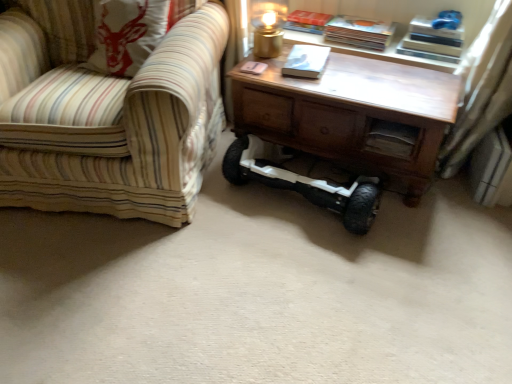
Measure the distance between hardcover book at upper right, positioned as the second book in front-to-back order, and camera.

hardcover book at upper right, positioned as the second book in front-to-back order, is 1.91 meters away from camera.

Identify the location of hardcover book at upper right, positioned as the second book in front-to-back order. (359, 32).

In order to face striped fabric chair at left, should I rotate leftwards or rightwards?

To face it directly, rotate left by 20.565 degrees.

At what (x,y) coordinates should I click in order to perform the action: click on striped fabric chair at left. Please return your answer as a coordinate pair (x, y). Looking at the image, I should click on (112, 124).

Find the location of `gold metallic table lamp at upper center`. gold metallic table lamp at upper center is located at coordinates tap(268, 26).

What do you see at coordinates (391, 139) in the screenshot? I see `wooden drawer at center` at bounding box center [391, 139].

Describe the element at coordinates (305, 180) in the screenshot. I see `white matte hoverboard at center` at that location.

What do you see at coordinates (307, 21) in the screenshot? The height and width of the screenshot is (384, 512). I see `hardcover book at upper center, the third book viewed from the front` at bounding box center [307, 21].

The height and width of the screenshot is (384, 512). I want to click on hardcover book at upper right, positioned as the second book in front-to-back order, so click(x=359, y=32).

Is white matte book at center, positioned as the 3th book in back-to-front order, facing away from striped fabric chair at left?

No.

From the image's perspective, is white matte book at center, marked as the first book in a front-to-back arrangement, over striped fabric chair at left?

Indeed, from the image's perspective, white matte book at center, marked as the first book in a front-to-back arrangement, is shown above striped fabric chair at left.

How many degrees apart are the facing directions of white matte book at center, positioned as the 3th book in back-to-front order, and striped fabric chair at left?

They differ by 8.96 degrees in their facing directions.

Which point is more forward, [311,48] or [34,101]?

The point [34,101] is closer.

How different are the orientations of wooden table at center and white matte book at center, marked as the first book in a front-to-back arrangement, in degrees?

There is a 9.18-degree angle between the facing directions of wooden table at center and white matte book at center, marked as the first book in a front-to-back arrangement.

Which object is closer to the camera taking this photo, wooden table at center or white matte book at center, marked as the first book in a front-to-back arrangement?

wooden table at center is more forward.

Which of these two, wooden table at center or white matte book at center, positioned as the 3th book in back-to-front order, stands shorter?

Standing shorter between the two is white matte book at center, positioned as the 3th book in back-to-front order.

Is wooden table at center in contact with white matte book at center, positioned as the 3th book in back-to-front order?

wooden table at center is not next to white matte book at center, positioned as the 3th book in back-to-front order, and they're not touching.

Locate an element on the screen. The width and height of the screenshot is (512, 384). chair on the left of white matte book at center, positioned as the 3th book in back-to-front order is located at coordinates (112, 124).

Consider the image. From a real-world perspective, between striped fabric chair at left and white matte book at center, positioned as the 3th book in back-to-front order, who is vertically higher?

In real-world perspective, white matte book at center, positioned as the 3th book in back-to-front order, is above.

In terms of size, does striped fabric chair at left appear bigger or smaller than white matte book at center, marked as the first book in a front-to-back arrangement?

Considering their sizes, striped fabric chair at left takes up more space than white matte book at center, marked as the first book in a front-to-back arrangement.

Is striped fabric chair at left not within white matte book at center, positioned as the 3th book in back-to-front order?

Yes.

Which of these two, gold metallic table lamp at upper center or white matte hoverboard at center, stands taller?

With more height is gold metallic table lamp at upper center.

Between gold metallic table lamp at upper center and white matte hoverboard at center, which one has smaller size?

gold metallic table lamp at upper center.

Would you consider gold metallic table lamp at upper center to be distant from white matte hoverboard at center?

gold metallic table lamp at upper center is actually quite close to white matte hoverboard at center.

From the image's perspective, is gold metallic table lamp at upper center above or below wooden table at center?

Clearly, from the image's perspective, gold metallic table lamp at upper center is above wooden table at center.

Is gold metallic table lamp at upper center surrounding wooden table at center?

No, wooden table at center is located outside of gold metallic table lamp at upper center.

Which object is positioned more to the left, gold metallic table lamp at upper center or wooden table at center?

A: gold metallic table lamp at upper center.

Which is in front, point (262, 161) or point (80, 88)?

The point (80, 88) is closer to the camera.

Locate an element on the screen. The image size is (512, 384). segway behind the striped fabric chair at left is located at coordinates (305, 180).

Considering the sizes of objects white matte hoverboard at center and striped fabric chair at left in the image provided, who is shorter, white matte hoverboard at center or striped fabric chair at left?

white matte hoverboard at center is shorter.

From a real-world perspective, is hardcover book at upper right, placed as the 2th book when sorted from back to front, above or below wooden drawer at center?

In terms of real-world spatial position, hardcover book at upper right, placed as the 2th book when sorted from back to front, is above wooden drawer at center.

Is hardcover book at upper right, placed as the 2th book when sorted from back to front, aimed at wooden drawer at center?

No, hardcover book at upper right, placed as the 2th book when sorted from back to front, is not oriented towards wooden drawer at center.

Is point (369, 34) positioned in front of point (390, 129)?

That is False.

Does hardcover book at upper right, placed as the 2th book when sorted from back to front, have a larger size compared to wooden drawer at center?

Indeed, hardcover book at upper right, placed as the 2th book when sorted from back to front, has a larger size compared to wooden drawer at center.

From a real-world perspective, starting from the striped fabric chair at left, which book is the 2nd one vertically above it? Please provide its 2D coordinates.

[(306, 61)]

Locate an element on the screen. Image resolution: width=512 pixels, height=384 pixels. table below the white matte book at center, marked as the first book in a front-to-back arrangement (from a real-world perspective) is located at coordinates (353, 115).

Consider the image. Based on their spatial positions, is gold metallic table lamp at upper center or white matte hoverboard at center closer to white matte book at center, marked as the first book in a front-to-back arrangement?

gold metallic table lamp at upper center.

Estimate the real-world distances between objects in this image. Which object is closer to wooden table at center, gold metallic table lamp at upper center or wooden drawer at center?

wooden drawer at center is positioned closer to the anchor wooden table at center.

When comparing their distances from hardcover book at upper center, the third book viewed from the front, does gold metallic table lamp at upper center or white matte book at center, marked as the first book in a front-to-back arrangement, seem further?

The object further to hardcover book at upper center, the third book viewed from the front, is white matte book at center, marked as the first book in a front-to-back arrangement.

Considering their positions, is striped fabric chair at left positioned closer to gold metallic table lamp at upper center than white matte book at center, positioned as the 3th book in back-to-front order?

Based on the image, white matte book at center, positioned as the 3th book in back-to-front order, appears to be nearer to gold metallic table lamp at upper center.

Which object lies nearer to the anchor point wooden drawer at center, hardcover book at upper center, the third book viewed from the front, or white matte book at center, positioned as the 3th book in back-to-front order?

Among the two, white matte book at center, positioned as the 3th book in back-to-front order, is located nearer to wooden drawer at center.

From the picture: Considering their positions, is wooden table at center positioned closer to white matte hoverboard at center than gold metallic table lamp at upper center?

wooden table at center lies closer to white matte hoverboard at center than the other object.

When comparing their distances from striped fabric chair at left, does white matte book at center, positioned as the 3th book in back-to-front order, or hardcover book at upper right, positioned as the second book in front-to-back order, seem closer?

Result: white matte book at center, positioned as the 3th book in back-to-front order, is positioned closer to the anchor striped fabric chair at left.

From the picture: When comparing their distances from gold metallic table lamp at upper center, does striped fabric chair at left or white matte hoverboard at center seem closer?

The object closer to gold metallic table lamp at upper center is white matte hoverboard at center.

Where is `book between striped fabric chair at left and hardcover book at upper center, the third book viewed from the front, in the horizontal direction`? This screenshot has height=384, width=512. book between striped fabric chair at left and hardcover book at upper center, the third book viewed from the front, in the horizontal direction is located at coordinates (306, 61).

Where is `table between hardcover book at upper center, which appears as the 1th book when viewed from the back, and white matte hoverboard at center from top to bottom`? table between hardcover book at upper center, which appears as the 1th book when viewed from the back, and white matte hoverboard at center from top to bottom is located at coordinates (353, 115).

What are the coordinates of `table that lies between gold metallic table lamp at upper center and wooden drawer at center from top to bottom` in the screenshot? It's located at (353, 115).

Where is `table lamp between hardcover book at upper right, placed as the 2th book when sorted from back to front, and wooden drawer at center from top to bottom`? Image resolution: width=512 pixels, height=384 pixels. table lamp between hardcover book at upper right, placed as the 2th book when sorted from back to front, and wooden drawer at center from top to bottom is located at coordinates (268, 26).